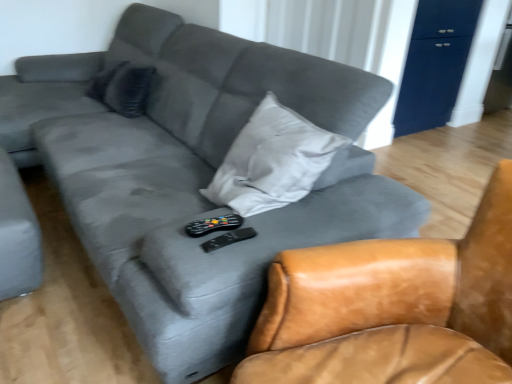
What do you see at coordinates (213, 225) in the screenshot?
I see `black plastic remote at center, which appears as the first remote when viewed from the top` at bounding box center [213, 225].

Locate an element on the screen. Image resolution: width=512 pixels, height=384 pixels. black plastic remote at center, marked as the 1th remote in a bottom-to-top arrangement is located at coordinates (228, 239).

Image resolution: width=512 pixels, height=384 pixels. Describe the element at coordinates (392, 307) in the screenshot. I see `leather armchair at center` at that location.

Where is `dark gray fabric pillow at upper left`? Image resolution: width=512 pixels, height=384 pixels. dark gray fabric pillow at upper left is located at coordinates (123, 88).

What do you see at coordinates (123, 88) in the screenshot? I see `dark gray fabric pillow at upper left` at bounding box center [123, 88].

The height and width of the screenshot is (384, 512). Find the location of `black plastic remote at center, which appears as the first remote when viewed from the top`. black plastic remote at center, which appears as the first remote when viewed from the top is located at coordinates (213, 225).

Could you tell me if dark gray fabric pillow at upper left is turned towards matte dark blue dresser at upper right?

No, dark gray fabric pillow at upper left is not oriented towards matte dark blue dresser at upper right.

What are the coordinates of `dresser on the right of dark gray fabric pillow at upper left` in the screenshot? It's located at (435, 63).

Who is more distant, dark gray fabric pillow at upper left or matte dark blue dresser at upper right?

matte dark blue dresser at upper right is more distant.

Based on the photo, which object is thinner, dark gray fabric pillow at upper left or matte dark blue dresser at upper right?

matte dark blue dresser at upper right.

Considering the sizes of matte dark blue dresser at upper right and dark gray fabric pillow at upper left in the image, is matte dark blue dresser at upper right taller or shorter than dark gray fabric pillow at upper left?

Considering their sizes, matte dark blue dresser at upper right has more height than dark gray fabric pillow at upper left.

Is point (434, 57) closer or farther from the camera than point (146, 69)?

Point (434, 57).

Is matte dark blue dresser at upper right in front of or behind dark gray fabric pillow at upper left in the image?

Visually, matte dark blue dresser at upper right is located behind dark gray fabric pillow at upper left.

Based on the photo, from a real-world perspective, is matte dark blue dresser at upper right physically located above or below dark gray fabric pillow at upper left?

From a real-world perspective, matte dark blue dresser at upper right is physically below dark gray fabric pillow at upper left.

From a real-world perspective, which object stands above the other?

In real-world perspective, black plastic remote at center, acting as the second remote starting from the bottom, is above.

Is black plastic remote at center, which appears as the first remote when viewed from the top, touching black plastic remote at center, marked as the 1th remote in a bottom-to-top arrangement?

Yes.

Is black plastic remote at center, which appears as the first remote when viewed from the top, shorter than black plastic remote at center, which is counted as the 2th remote, starting from the top?

Incorrect, the height of black plastic remote at center, which appears as the first remote when viewed from the top, does not fall short of that of black plastic remote at center, which is counted as the 2th remote, starting from the top.

Measure the distance between black plastic remote at center, which appears as the first remote when viewed from the top, and black plastic remote at center, which is counted as the 2th remote, starting from the top.

Result: They are 3.94 centimeters apart.

From the image's perspective, is leather armchair at center above or below dark gray fabric pillow at upper left?

From the image's perspective, leather armchair at center appears below dark gray fabric pillow at upper left.

Is leather armchair at center completely or partially outside of dark gray fabric pillow at upper left?

Absolutely, leather armchair at center is external to dark gray fabric pillow at upper left.

From a real-world perspective, is leather armchair at center positioned under dark gray fabric pillow at upper left based on gravity?

Indeed, from a real-world perspective, leather armchair at center is positioned beneath dark gray fabric pillow at upper left.

Which of these two, leather armchair at center or dark gray fabric pillow at upper left, is smaller?

dark gray fabric pillow at upper left.

Is point (210, 231) more distant than point (137, 94)?

No, it is not.

Considering the relative sizes of black plastic remote at center, which appears as the first remote when viewed from the top, and dark gray fabric pillow at upper left in the image provided, is black plastic remote at center, which appears as the first remote when viewed from the top, thinner than dark gray fabric pillow at upper left?

Yes.

You are a GUI agent. You are given a task and a screenshot of the screen. Output one action in this format:
    pyautogui.click(x=<x>, y=<y>)
    Task: Click on the remote that is the 1st object located in front of the dark gray fabric pillow at upper left
    This screenshot has width=512, height=384.
    Given the screenshot: What is the action you would take?
    pyautogui.click(x=213, y=225)

From the image's perspective, is black plastic remote at center, which appears as the first remote when viewed from the top, positioned above or below dark gray fabric pillow at upper left?

Clearly, from the image's perspective, black plastic remote at center, which appears as the first remote when viewed from the top, is below dark gray fabric pillow at upper left.

Who is taller, black plastic remote at center, which is counted as the 2th remote, starting from the top, or matte dark blue dresser at upper right?

matte dark blue dresser at upper right is taller.

Is black plastic remote at center, marked as the 1th remote in a bottom-to-top arrangement, far away from matte dark blue dresser at upper right?

black plastic remote at center, marked as the 1th remote in a bottom-to-top arrangement, is far away from matte dark blue dresser at upper right.

Considering the sizes of objects black plastic remote at center, marked as the 1th remote in a bottom-to-top arrangement, and matte dark blue dresser at upper right in the image provided, who is thinner, black plastic remote at center, marked as the 1th remote in a bottom-to-top arrangement, or matte dark blue dresser at upper right?

Thinner between the two is matte dark blue dresser at upper right.

Is black plastic remote at center, which is counted as the 2th remote, starting from the top, bigger or smaller than matte dark blue dresser at upper right?

Clearly, black plastic remote at center, which is counted as the 2th remote, starting from the top, is smaller in size than matte dark blue dresser at upper right.

Identify the location of remote that appears below the black plastic remote at center, acting as the second remote starting from the bottom (from the image's perspective). The image size is (512, 384). [x=228, y=239].

Between point (225, 235) and point (241, 222), which one is positioned behind?

Point (241, 222)

In the image, is black plastic remote at center, which is counted as the 2th remote, starting from the top, on the left side or the right side of black plastic remote at center, acting as the second remote starting from the bottom?

black plastic remote at center, which is counted as the 2th remote, starting from the top, is to the right of black plastic remote at center, acting as the second remote starting from the bottom.

There is a matte dark blue dresser at upper right. Find the location of `pillow above it (from a real-world perspective)`. pillow above it (from a real-world perspective) is located at coordinates (123, 88).

This screenshot has height=384, width=512. Find the location of `dresser behind the dark gray fabric pillow at upper left`. dresser behind the dark gray fabric pillow at upper left is located at coordinates (435, 63).

Looking at this image, when comparing their distances from dark gray fabric pillow at upper left, does leather armchair at center or black plastic remote at center, acting as the second remote starting from the bottom, seem further?

leather armchair at center is positioned further to the anchor dark gray fabric pillow at upper left.

Which object lies nearer to the anchor point dark gray fabric pillow at upper left, leather armchair at center or matte dark blue dresser at upper right?

Among the two, leather armchair at center is located nearer to dark gray fabric pillow at upper left.

Which object lies further to the anchor point dark gray fabric pillow at upper left, black plastic remote at center, which appears as the first remote when viewed from the top, or leather armchair at center?

leather armchair at center is further to dark gray fabric pillow at upper left.

Looking at the image, which one is located further to black plastic remote at center, marked as the 1th remote in a bottom-to-top arrangement, dark gray fabric pillow at upper left or black plastic remote at center, which appears as the first remote when viewed from the top?

Among the two, dark gray fabric pillow at upper left is located further to black plastic remote at center, marked as the 1th remote in a bottom-to-top arrangement.

From the picture: Which object lies further to the anchor point black plastic remote at center, acting as the second remote starting from the bottom, leather armchair at center or black plastic remote at center, which is counted as the 2th remote, starting from the top?

leather armchair at center lies further to black plastic remote at center, acting as the second remote starting from the bottom, than the other object.

Which object lies further to the anchor point dark gray fabric pillow at upper left, matte dark blue dresser at upper right or leather armchair at center?

Among the two, matte dark blue dresser at upper right is located further to dark gray fabric pillow at upper left.

Based on their spatial positions, is black plastic remote at center, acting as the second remote starting from the bottom, or dark gray fabric pillow at upper left closer to black plastic remote at center, which is counted as the 2th remote, starting from the top?

black plastic remote at center, acting as the second remote starting from the bottom, is positioned closer to the anchor black plastic remote at center, which is counted as the 2th remote, starting from the top.

Based on their spatial positions, is black plastic remote at center, marked as the 1th remote in a bottom-to-top arrangement, or matte dark blue dresser at upper right further from leather armchair at center?

The object further to leather armchair at center is matte dark blue dresser at upper right.

The image size is (512, 384). I want to click on remote between leather armchair at center and black plastic remote at center, which appears as the first remote when viewed from the top, in the front-back direction, so click(x=228, y=239).

Locate an element on the screen. This screenshot has height=384, width=512. pillow between leather armchair at center and matte dark blue dresser at upper right from front to back is located at coordinates 123,88.

Identify the location of remote between black plastic remote at center, which is counted as the 2th remote, starting from the top, and dark gray fabric pillow at upper left from front to back. (213, 225).

I want to click on remote between black plastic remote at center, which is counted as the 2th remote, starting from the top, and matte dark blue dresser at upper right from front to back, so click(213, 225).